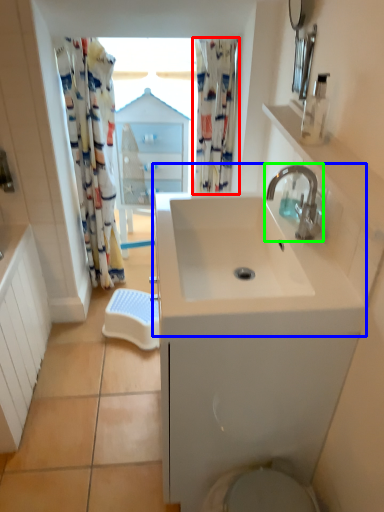
Question: Which object is the farthest from shower curtain (highlighted by a red box)? Choose among these: sink (highlighted by a blue box) or tap (highlighted by a green box).

Choices:
 (A) sink
 (B) tap

Answer: (A)